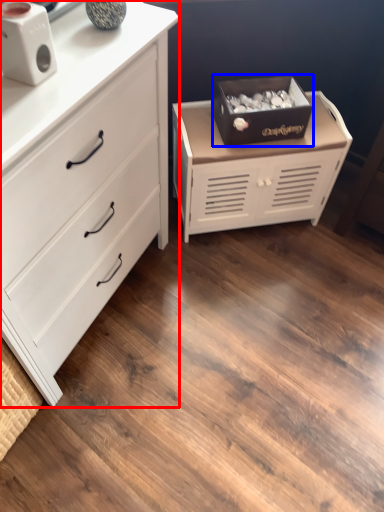
Question: Which object is closer to the camera taking this photo, chest of drawers (highlighted by a red box) or storage box (highlighted by a blue box)?

Choices:
 (A) chest of drawers
 (B) storage box

Answer: (A)